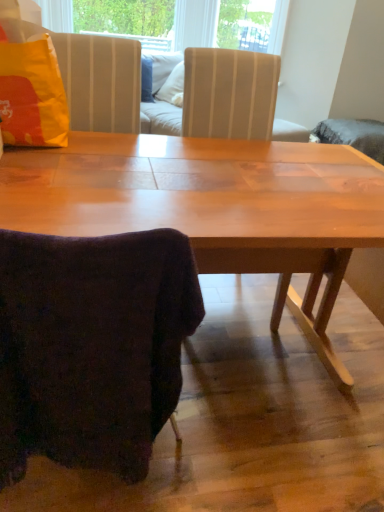
Question: Considering the relative positions of matte yellow pillow at upper left and velvety dark purple chair at lower left in the image provided, is matte yellow pillow at upper left to the left or to the right of velvety dark purple chair at lower left?

Choices:
 (A) right
 (B) left

Answer: (B)

Question: From a real-world perspective, is matte yellow pillow at upper left above or below velvety dark purple chair at lower left?

Choices:
 (A) above
 (B) below

Answer: (A)

Question: Is point (46, 135) positioned closer to the camera than point (130, 291)?

Choices:
 (A) farther
 (B) closer

Answer: (A)

Question: Would you say velvety dark purple chair at lower left is to the left or to the right of matte yellow pillow at upper left in the picture?

Choices:
 (A) left
 (B) right

Answer: (B)

Question: From a real-world perspective, is velvety dark purple chair at lower left positioned above or below matte yellow pillow at upper left?

Choices:
 (A) below
 (B) above

Answer: (A)

Question: Is velvety dark purple chair at lower left bigger or smaller than matte yellow pillow at upper left?

Choices:
 (A) small
 (B) big

Answer: (B)

Question: From the image's perspective, relative to matte yellow pillow at upper left, is velvety dark purple chair at lower left above or below?

Choices:
 (A) above
 (B) below

Answer: (B)